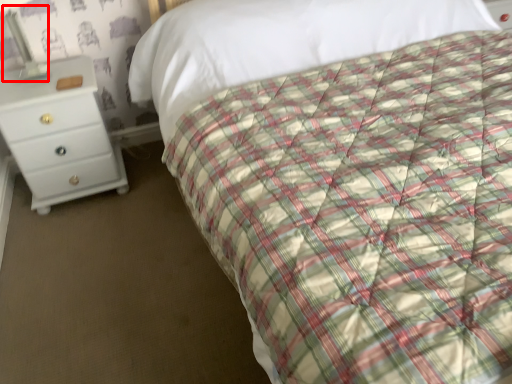
Question: Considering the relative positions of bedside lamp (annotated by the red box) and chest of drawers in the image provided, where is bedside lamp (annotated by the red box) located with respect to the staircase?

Choices:
 (A) right
 (B) left

Answer: (B)